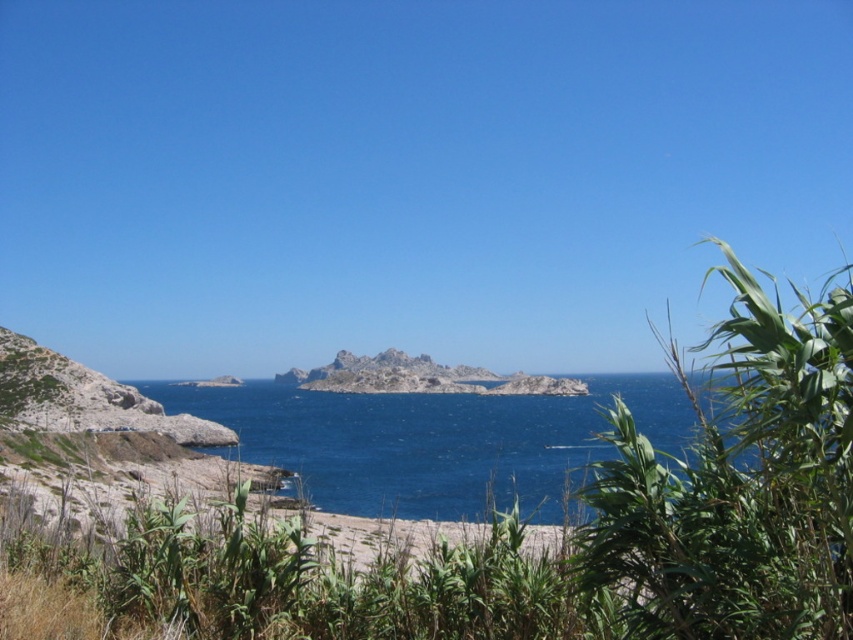
Question: Is blue water at center to the right of rocky island at center from the viewer's perspective?

Choices:
 (A) no
 (B) yes

Answer: (B)

Question: Can you confirm if green leafy plant at right is smaller than blue water at center?

Choices:
 (A) no
 (B) yes

Answer: (B)

Question: Does blue water at center have a smaller size compared to rocky island at center?

Choices:
 (A) no
 (B) yes

Answer: (A)

Question: Estimate the real-world distances between objects in this image. Which object is closer to the green leafy plant at right?

Choices:
 (A) blue water at center
 (B) rocky island at center

Answer: (A)

Question: Considering the real-world distances, which object is farthest from the green leafy plant at right?

Choices:
 (A) rocky island at center
 (B) blue water at center

Answer: (A)

Question: Among these points, which one is farthest from the camera?

Choices:
 (A) (242, 452)
 (B) (334, 356)
 (C) (712, 608)

Answer: (B)